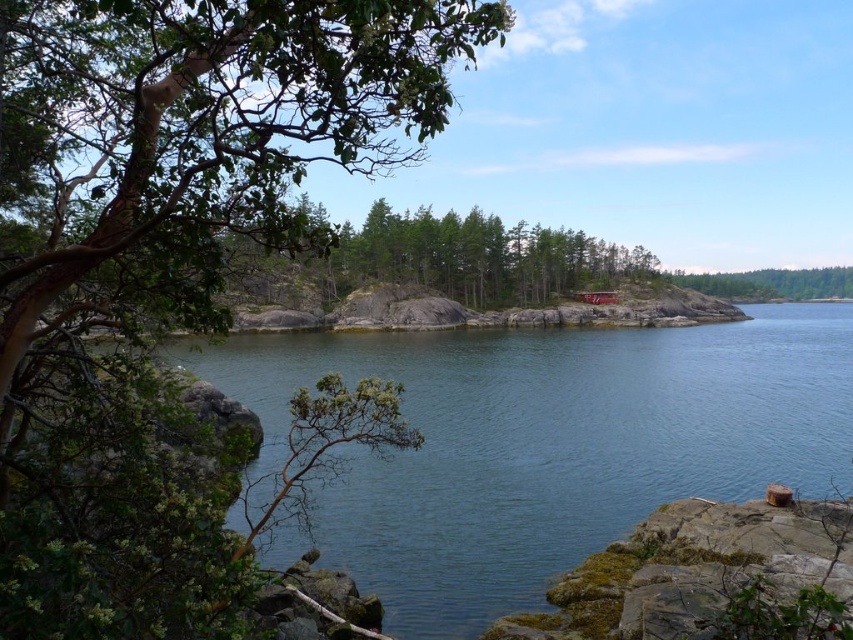
Is green leafy tree at left taller than green leafy tree at right?

Yes.

Does green leafy tree at left have a smaller size compared to green leafy tree at right?

Yes.

Is point (167, 138) positioned in front of point (793, 296)?

Yes.

You are a GUI agent. You are given a task and a screenshot of the screen. Output one action in this format:
    pyautogui.click(x=<x>, y=<y>)
    Task: Click on the green leafy tree at left
    
    Given the screenshot: What is the action you would take?
    pyautogui.click(x=164, y=257)

Who is lower down, green leafy tree at left or clear water at center?

clear water at center

You are a GUI agent. You are given a task and a screenshot of the screen. Output one action in this format:
    pyautogui.click(x=<x>, y=<y>)
    Task: Click on the green leafy tree at left
    This screenshot has width=853, height=640.
    Given the screenshot: What is the action you would take?
    pyautogui.click(x=164, y=257)

Is clear water at center taller than green leafy tree at right?

Incorrect, clear water at center's height is not larger of green leafy tree at right's.

Can you confirm if clear water at center is positioned above green leafy tree at right?

Actually, clear water at center is below green leafy tree at right.

Which is behind, point (624, 358) or point (809, 285)?

Point (809, 285)

This screenshot has width=853, height=640. What are the coordinates of `clear water at center` in the screenshot? It's located at (543, 444).